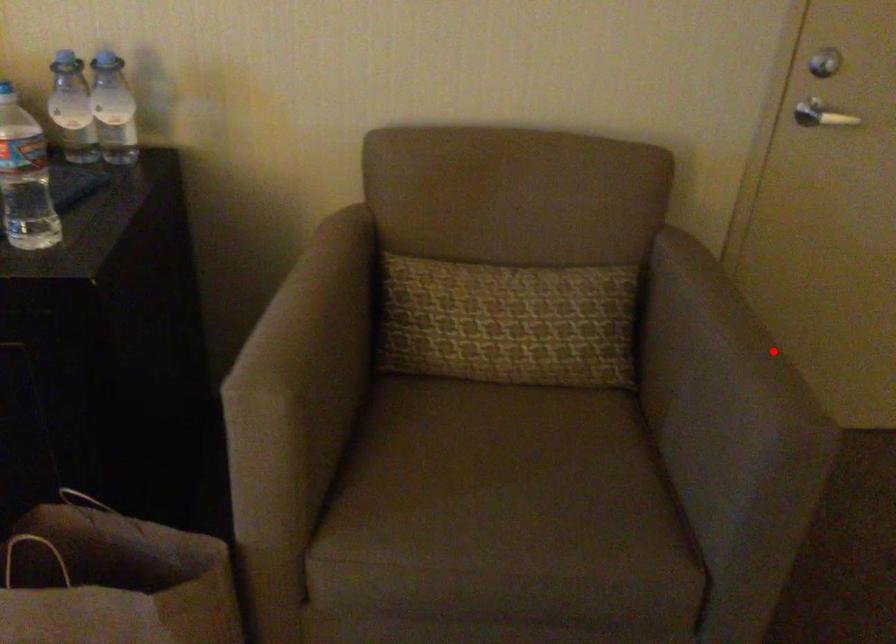
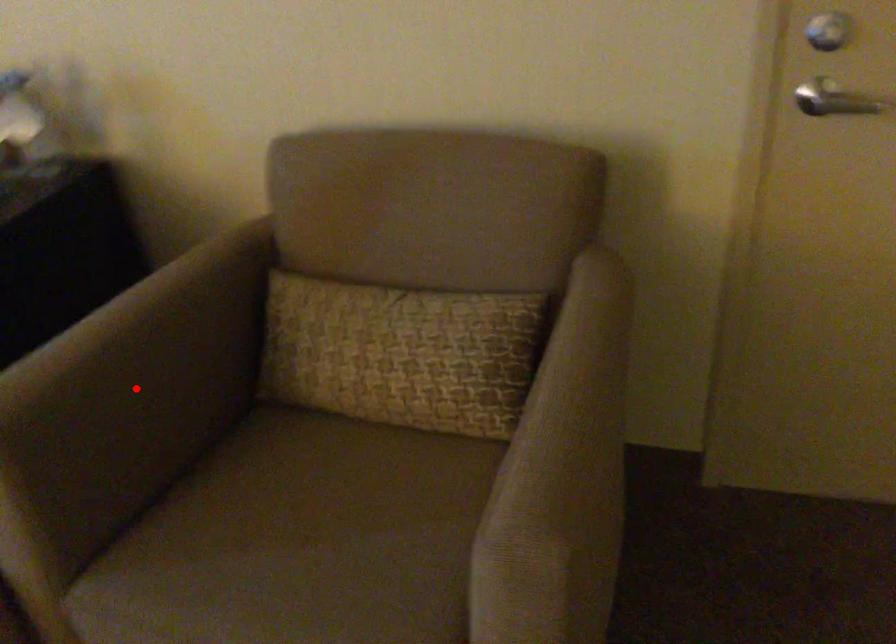
I am providing you with two images of the same scene from different viewpoints. A red point is marked on the first image and another point is marked on the second image. Do the highlighted points in image1 and image2 indicate the same real-world spot?

No